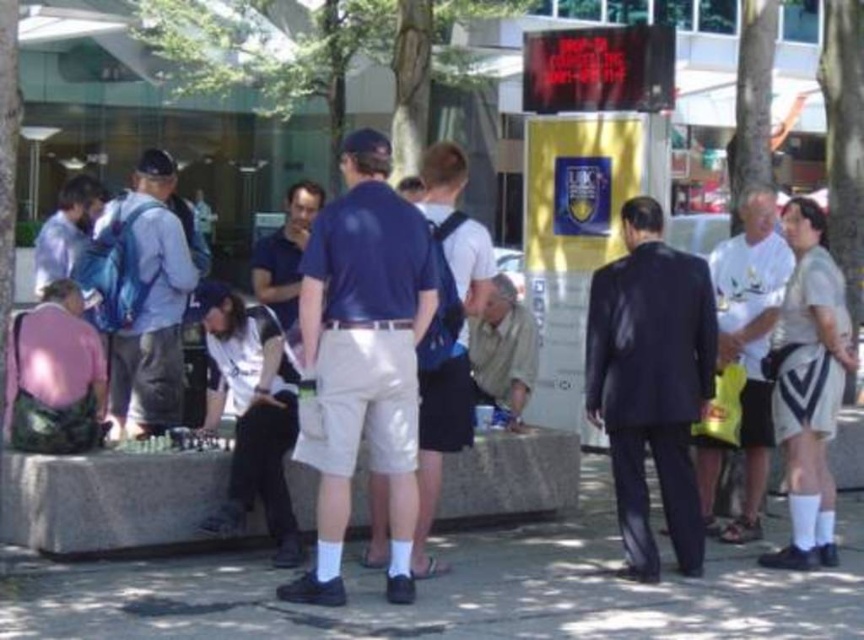
Question: Is blue fabric backpack at left wider than light blue shirt at center?

Choices:
 (A) no
 (B) yes

Answer: (A)

Question: Is dark blue leather suit at center thinner than white cotton t-shirt at right?

Choices:
 (A) yes
 (B) no

Answer: (B)

Question: Is light beige shorts at center further to the viewer compared to light blue shirt at center?

Choices:
 (A) no
 (B) yes

Answer: (A)

Question: Which point is farther from the camera taking this photo?

Choices:
 (A) (299, 301)
 (B) (672, 394)

Answer: (A)

Question: Estimate the real-world distances between objects in this image. Which object is farther from the dark blue shirt at center?

Choices:
 (A) light brown fabric shirt at center
 (B) blue fabric backpack at left

Answer: (B)

Question: Based on their relative distances, which object is farther from the white cotton t-shirt at right?

Choices:
 (A) light beige shorts at center
 (B) dark blue shirt at center
 (C) blue fabric backpack at left

Answer: (C)